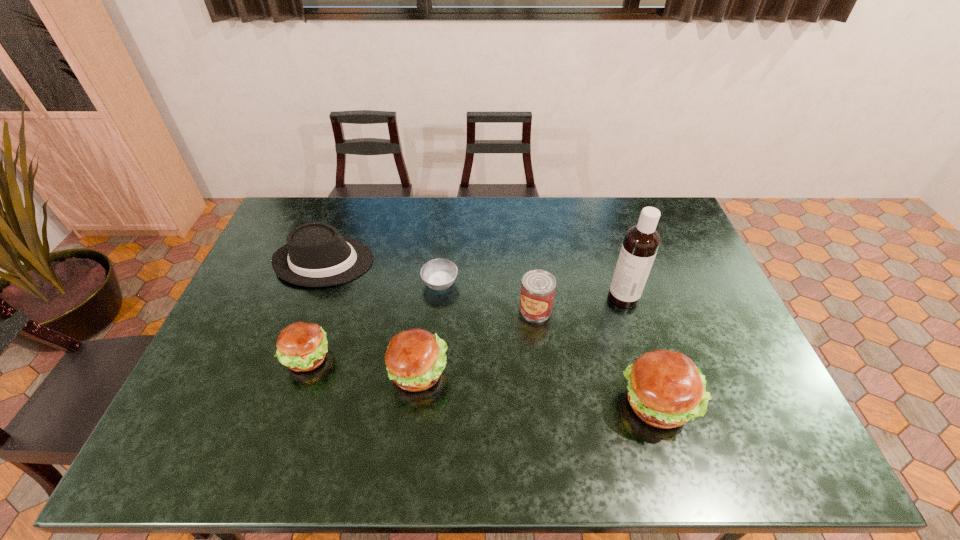
What are the coordinates of `vacant position at the near edge of the desktop` in the screenshot? It's located at (503, 419).

Identify the location of vacant point at the left edge. Image resolution: width=960 pixels, height=540 pixels. (235, 381).

You are a GUI agent. You are given a task and a screenshot of the screen. Output one action in this format:
    pyautogui.click(x=<x>, y=<y>)
    Task: Click on the free region at the right edge of the desktop
    
    Given the screenshot: What is the action you would take?
    pyautogui.click(x=717, y=349)

Locate an element on the screen. vacant region at the near right corner of the desktop is located at coordinates (755, 388).

What are the coordinates of `vacant area that lies between the second hamburger from right to left and the dishwasher detergent` in the screenshot? It's located at (521, 335).

You are a GUI agent. You are given a task and a screenshot of the screen. Output one action in this format:
    pyautogui.click(x=<x>, y=<y>)
    Task: Click on the free space between the tallest object and the fedora
    This screenshot has height=540, width=960.
    Given the screenshot: What is the action you would take?
    click(x=474, y=279)

Identify the location of vacant area between the can and the shortest object. (488, 296).

Identify the location of free space between the third object from right to left and the ashtray. (488, 296).

This screenshot has height=540, width=960. In order to click on free space that is in between the rightmost hamburger and the second hamburger from left to right in this screenshot , I will do `click(538, 387)`.

The image size is (960, 540). I want to click on free space between the leftmost hamburger and the tallest object, so click(466, 328).